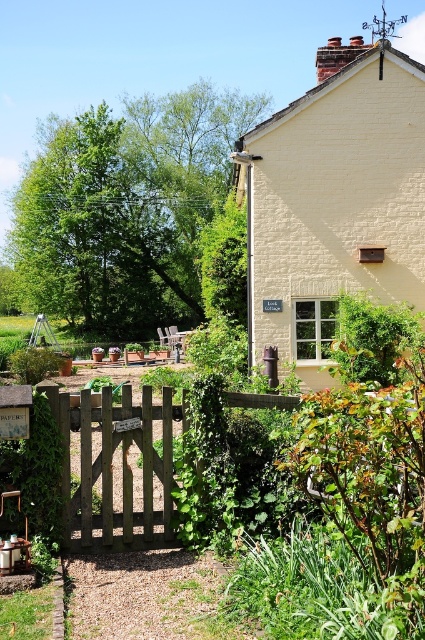
Question: Is yellow brick cottage at upper center positioned at the back of brown wooden gate at center?

Choices:
 (A) no
 (B) yes

Answer: (B)

Question: Does yellow brick cottage at upper center lie behind brown wooden gate at center?

Choices:
 (A) yes
 (B) no

Answer: (A)

Question: Among these points, which one is farthest from the camera?

Choices:
 (A) pos(336,172)
 (B) pos(107,525)

Answer: (A)

Question: Which point appears farthest from the camera in this image?

Choices:
 (A) (360, 138)
 (B) (167, 444)

Answer: (A)

Question: Does yellow brick cottage at upper center have a smaller size compared to brown wooden gate at center?

Choices:
 (A) no
 (B) yes

Answer: (A)